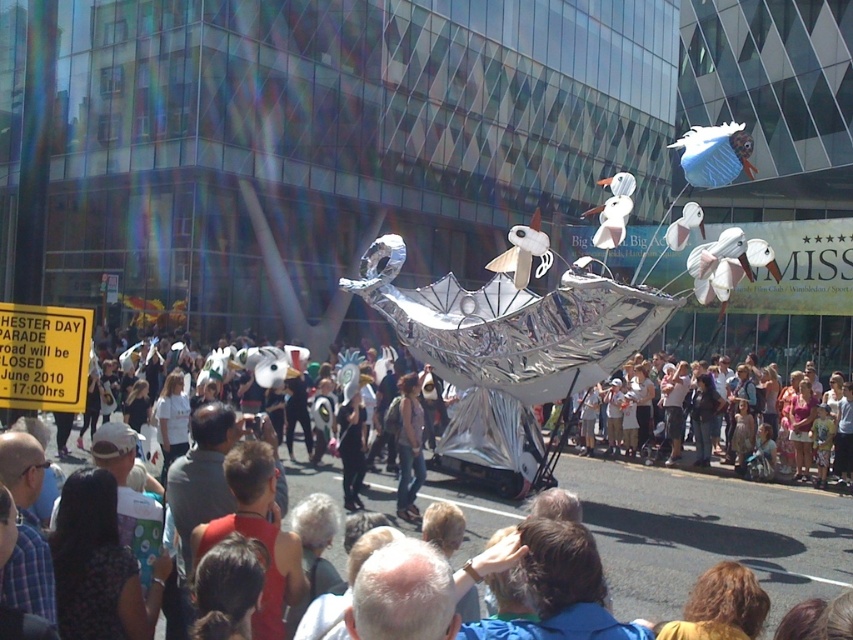
You are a photographer trying to capture the entire reflective silver umbrella at center and the white cotton crowd at lower right in one frame. Based on their sizes, which object should you focus on to ensure both fit in the photo?

The reflective silver umbrella at center has a larger width than the white cotton crowd at lower right, so focusing on the reflective silver umbrella at center will help ensure both fit in the photo by adjusting the camera angle to accommodate its larger size.

You are standing at the parade and want to take a photo of both the metallic sculpture and the yellow signboard. The metallic sculpture is located at point (605, 531) and the yellow signboard is at point (843, 376). Which point should you focus on first to ensure both are in the frame?

You should focus on point (605, 531) first because it is closer to you than point (843, 376). This way, both points will be in the frame as you adjust the camera.